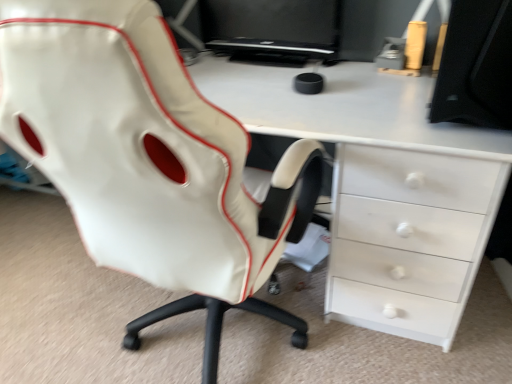
I want to click on free space to the left of black glossy monitor at upper center, so click(224, 69).